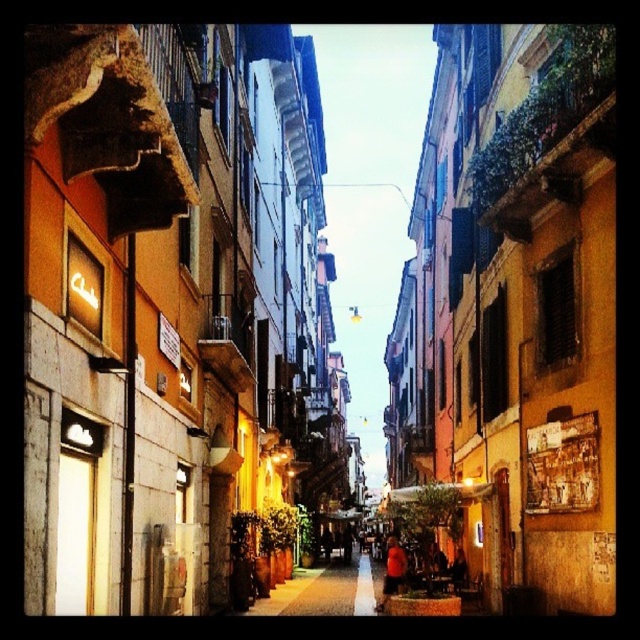
You are a delivery person trying to navigate through the narrow street. You see the brown stone planter at center and the orange fabric shirt at lower center. Which object is positioned lower in the scene?

The brown stone planter at center is located below orange fabric shirt at lower center, so the brown stone planter at center is positioned lower in the scene.

You are a delivery person who needs to place a large package on top of the brown stone planter at center. Considering the height of the orange fabric shirt at lower center, can you estimate if the package will be visible from the ground level?

The brown stone planter at center is taller than the orange fabric shirt at lower center. Since the package is placed on top of the planter, it will likely be visible from the ground level as it exceeds the height of the shirt.

You are standing at the entrance of the narrow street scene. You see two points marked as point 1 and point 2. Point 1 is at coordinates (364, 611) and point 2 is at (394, 582). Which point is closer to your current position?

Point 1 at coordinates (364, 611) is closer to your current position because it is closer to the camera than point 2 at (394, 582).